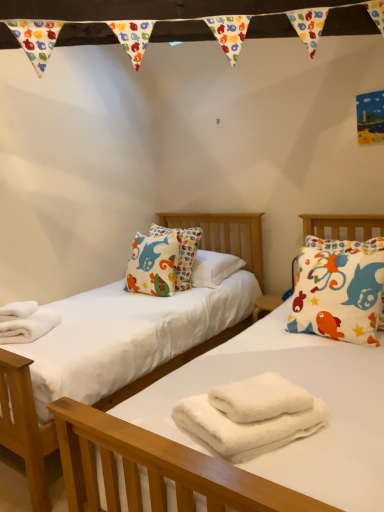
Where is `vacant space situated above white fluffy bath towel at center, the first bath towel when ordered from top to bottom (from a real-world perspective)`? This screenshot has width=384, height=512. vacant space situated above white fluffy bath towel at center, the first bath towel when ordered from top to bottom (from a real-world perspective) is located at coordinates (249, 387).